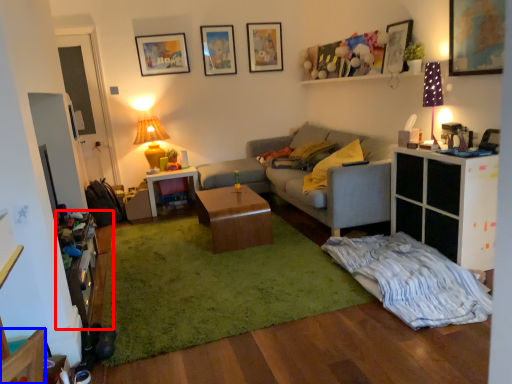
Question: Which point is closer to the camera, dresser (highlighted by a red box) or armchair (highlighted by a blue box)?

Choices:
 (A) dresser
 (B) armchair

Answer: (B)